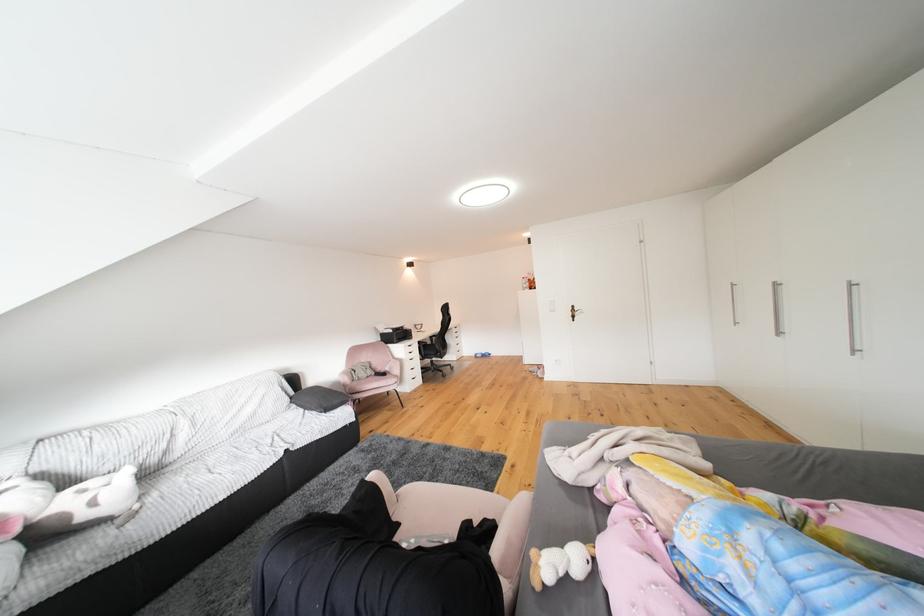
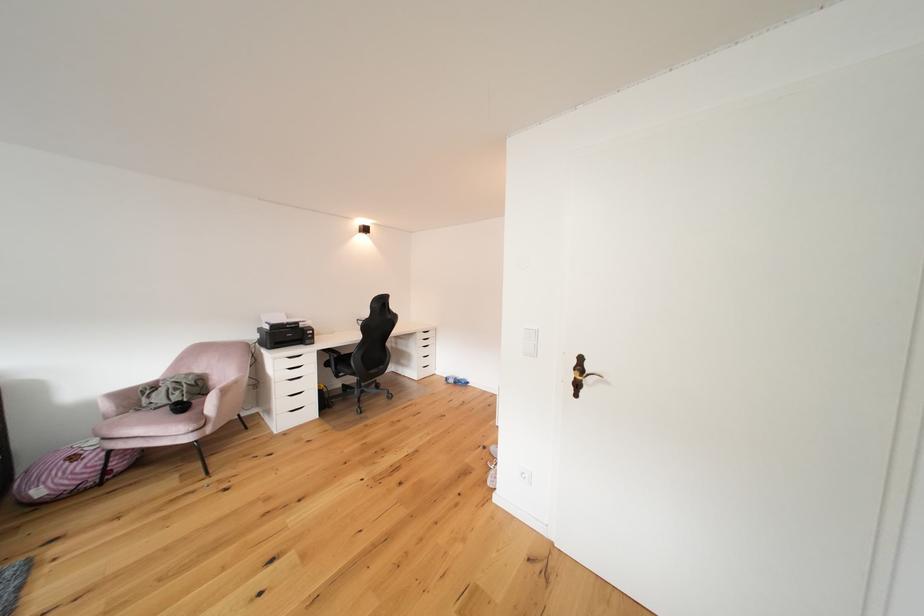
In the second image, find the point that corresponds to point (484, 359) in the first image.

(456, 383)